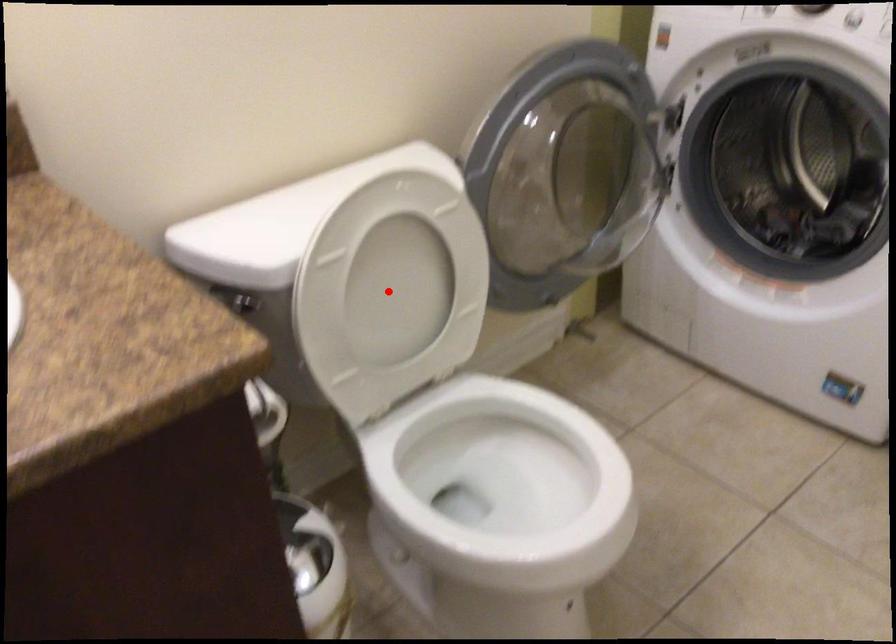
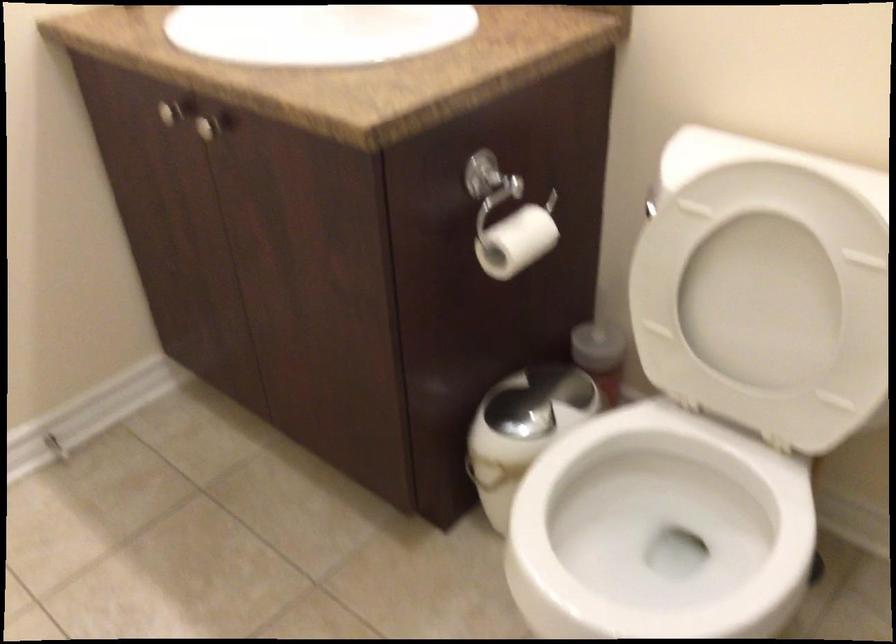
Question: I am providing you with two images of the same scene from different viewpoints. In image1, a red point is highlighted. Considering the same 3D point in image2, which of the following is correct?

Choices:
 (A) It is closer
 (B) It is farther

Answer: (A)